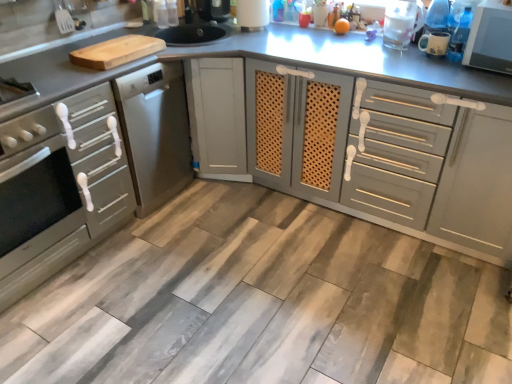
The image size is (512, 384). In order to click on vacant area that lies between matte white mug at upper right, which is the 3th appliance in back-to-front order, and white textured paper towel holder at upper center, which ranks as the first appliance in left-to-right order in this screenshot , I will do `click(325, 41)`.